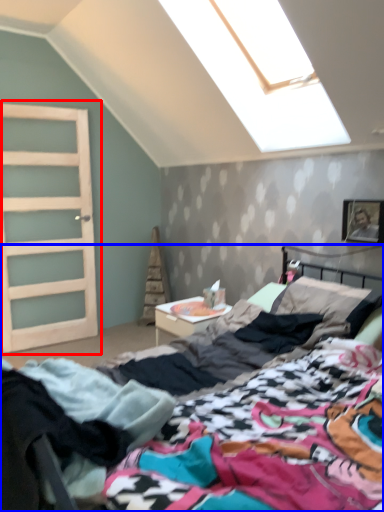
Question: Among these objects, which one is farthest to the camera, door (highlighted by a red box) or bed (highlighted by a blue box)?

Choices:
 (A) door
 (B) bed

Answer: (A)